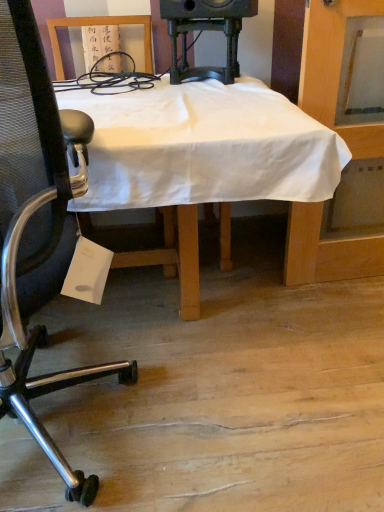
Question: Can you confirm if white cloth-covered desk at center is shorter than metallic mesh chair at left?

Choices:
 (A) yes
 (B) no

Answer: (A)

Question: From the image's perspective, would you say white cloth-covered desk at center is shown under metallic mesh chair at left?

Choices:
 (A) yes
 (B) no

Answer: (B)

Question: Considering the relative sizes of white cloth-covered desk at center and metallic mesh chair at left in the image provided, is white cloth-covered desk at center smaller than metallic mesh chair at left?

Choices:
 (A) yes
 (B) no

Answer: (B)

Question: Is metallic mesh chair at left inside white cloth-covered desk at center?

Choices:
 (A) yes
 (B) no

Answer: (A)

Question: From a real-world perspective, is white cloth-covered desk at center located higher than metallic mesh chair at left?

Choices:
 (A) no
 (B) yes

Answer: (A)

Question: Can you confirm if white cloth-covered desk at center is wider than metallic mesh chair at left?

Choices:
 (A) yes
 (B) no

Answer: (A)

Question: Is black plastic speaker at upper center to the left of white cloth-covered desk at center from the viewer's perspective?

Choices:
 (A) no
 (B) yes

Answer: (A)

Question: From a real-world perspective, is black plastic speaker at upper center on white cloth-covered desk at center?

Choices:
 (A) no
 (B) yes

Answer: (B)

Question: Can you confirm if black plastic speaker at upper center is taller than white cloth-covered desk at center?

Choices:
 (A) no
 (B) yes

Answer: (A)

Question: Could you tell me if black plastic speaker at upper center is facing white cloth-covered desk at center?

Choices:
 (A) yes
 (B) no

Answer: (B)

Question: Is black plastic speaker at upper center completely or partially outside of white cloth-covered desk at center?

Choices:
 (A) no
 (B) yes

Answer: (A)

Question: From the image's perspective, is black plastic speaker at upper center above white cloth-covered desk at center?

Choices:
 (A) yes
 (B) no

Answer: (A)

Question: Does metallic mesh chair at left appear on the right side of black plastic speaker at upper center?

Choices:
 (A) yes
 (B) no

Answer: (B)